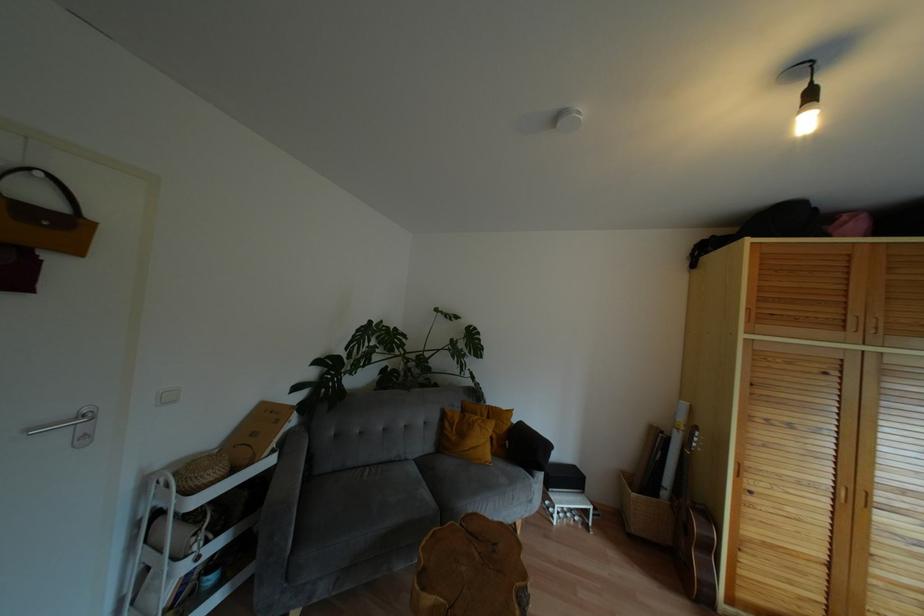
The height and width of the screenshot is (616, 924). What are the coordinates of `hanging light bulb` in the screenshot? It's located at (806, 99).